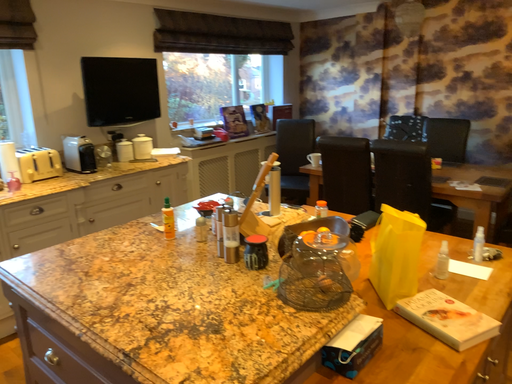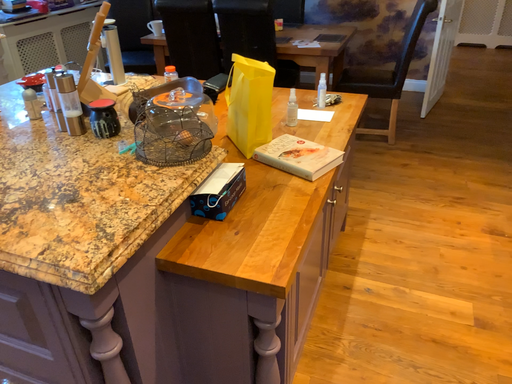
Question: How did the camera likely rotate when shooting the video?

Choices:
 (A) rotated upward
 (B) rotated downward

Answer: (B)